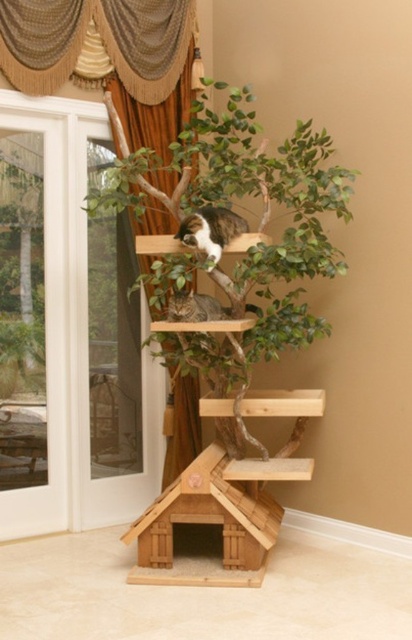
Who is shorter, tabby fur cat at upper center or tabby fur cat at center?

With less height is tabby fur cat at center.

Can you confirm if tabby fur cat at upper center is thinner than tabby fur cat at center?

Yes.

Does point (217, 243) come in front of point (201, 317)?

Yes, point (217, 243) is in front of point (201, 317).

In order to click on tabby fur cat at upper center in this screenshot , I will do `click(210, 228)`.

At what (x,y) coordinates should I click in order to perform the action: click on wooden cat tree at center. Please return your answer as a coordinate pair (x, y). The image size is (412, 640). Looking at the image, I should click on (250, 244).

Between wooden cat tree at center and tabby fur cat at upper center, which one has less height?

tabby fur cat at upper center

Does point (299, 259) come farther from viewer compared to point (205, 250)?

No, it is not.

I want to click on wooden cat tree at center, so click(x=250, y=244).

Is wooden cat tree at center behind tabby fur cat at center?

That is False.

Describe the element at coordinates (250, 244) in the screenshot. I see `wooden cat tree at center` at that location.

I want to click on wooden cat tree at center, so click(x=250, y=244).